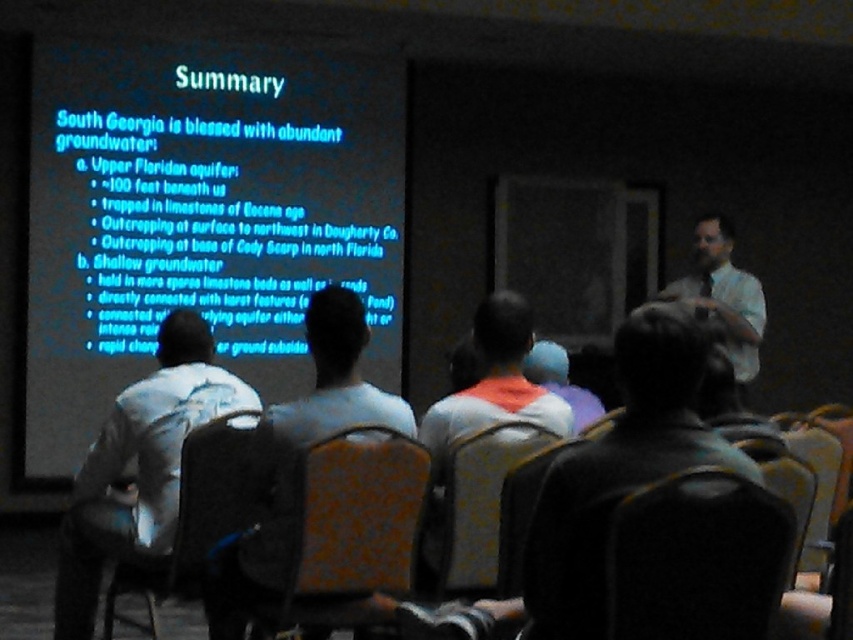
Does blue text on projector screen at upper center have a lesser height compared to dark gray backpack at center?

In fact, blue text on projector screen at upper center may be taller than dark gray backpack at center.

Image resolution: width=853 pixels, height=640 pixels. Describe the element at coordinates (200, 216) in the screenshot. I see `blue text on projector screen at upper center` at that location.

Describe the element at coordinates (200, 216) in the screenshot. I see `blue text on projector screen at upper center` at that location.

Identify the location of blue text on projector screen at upper center. (200, 216).

Is blue text on projector screen at upper center wider than velvet-like fabric chair at center?

Yes, blue text on projector screen at upper center is wider than velvet-like fabric chair at center.

Who is more distant from viewer, (33, 477) or (485, 465)?

The point (33, 477) is behind.

The image size is (853, 640). I want to click on blue text on projector screen at upper center, so click(200, 216).

Between blue text on projector screen at upper center and patterned fabric chair at center, which one appears on the left side from the viewer's perspective?

blue text on projector screen at upper center

Describe the element at coordinates (200, 216) in the screenshot. The height and width of the screenshot is (640, 853). I see `blue text on projector screen at upper center` at that location.

You are a GUI agent. You are given a task and a screenshot of the screen. Output one action in this format:
    pyautogui.click(x=<x>, y=<y>)
    Task: Click on the blue text on projector screen at upper center
    This screenshot has height=640, width=853.
    Given the screenshot: What is the action you would take?
    pyautogui.click(x=200, y=216)

Find the location of a particular element. blue text on projector screen at upper center is located at coordinates (200, 216).